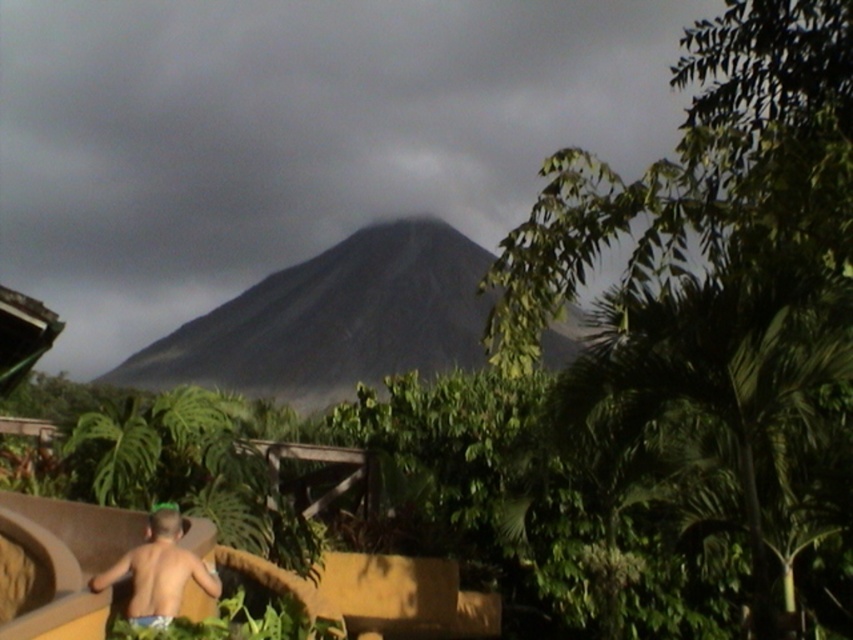
Question: Which point appears farthest from the camera in this image?

Choices:
 (A) (338, 328)
 (B) (175, 566)

Answer: (A)

Question: Can you confirm if dark gray volcanic rock at center is smaller than light blue fabric at lower left?

Choices:
 (A) no
 (B) yes

Answer: (A)

Question: Does dark gray volcanic rock at center have a larger size compared to light blue fabric at lower left?

Choices:
 (A) yes
 (B) no

Answer: (A)

Question: Is dark gray volcanic rock at center positioned behind light blue fabric at lower left?

Choices:
 (A) yes
 (B) no

Answer: (A)

Question: Which of the following is the closest to the observer?

Choices:
 (A) (155, 605)
 (B) (345, 378)

Answer: (A)

Question: Which point is farther to the camera?

Choices:
 (A) (154, 611)
 (B) (341, 372)

Answer: (B)